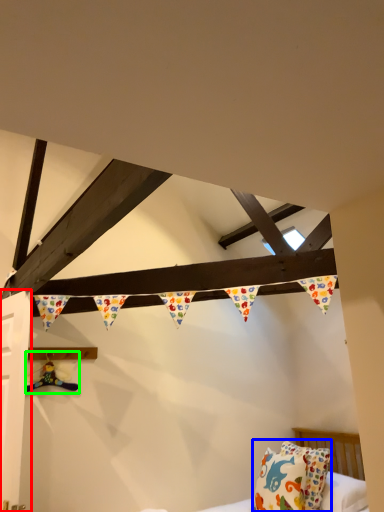
Question: Which is nearer to the door (highlighted by a red box)? pillow (highlighted by a blue box) or toy (highlighted by a green box).

Choices:
 (A) pillow
 (B) toy

Answer: (B)